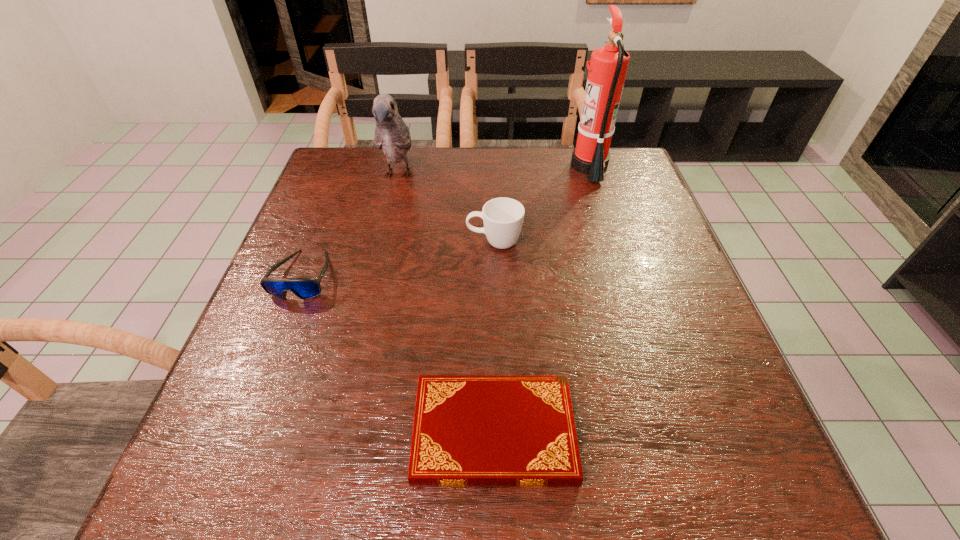
Find the location of a particular element. The width and height of the screenshot is (960, 540). vacant space positioned 0.310m at the nozzle of the rightmost object is located at coordinates (463, 167).

Locate an element on the screen. free space located at the nozzle of the rightmost object is located at coordinates (509, 167).

Identify the location of vacant region located on the front-facing side of the parrot. The height and width of the screenshot is (540, 960). (385, 234).

Locate an element on the screen. This screenshot has height=540, width=960. vacant space located with the handle on the side of the third tallest object is located at coordinates (424, 242).

At what (x,y) coordinates should I click in order to perform the action: click on free spot located with the handle on the side of the third tallest object. Please return your answer as a coordinate pair (x, y). The width and height of the screenshot is (960, 540). Looking at the image, I should click on (403, 242).

This screenshot has width=960, height=540. In order to click on free space located 0.110m with the handle on the side of the third tallest object in this screenshot , I will do `click(420, 242)`.

This screenshot has width=960, height=540. Find the location of `blank area located 0.080m on the front-facing side of the leftmost object`. blank area located 0.080m on the front-facing side of the leftmost object is located at coordinates (280, 335).

Where is `free space located 0.240m on the cover of the nearest object`? The height and width of the screenshot is (540, 960). free space located 0.240m on the cover of the nearest object is located at coordinates (268, 434).

Locate an element on the screen. This screenshot has width=960, height=540. vacant point located on the cover of the nearest object is located at coordinates (372, 434).

At what (x,y) coordinates should I click in order to perform the action: click on vacant space located on the cover of the nearest object. Please return your answer as a coordinate pair (x, y). The image size is (960, 540). Looking at the image, I should click on (317, 434).